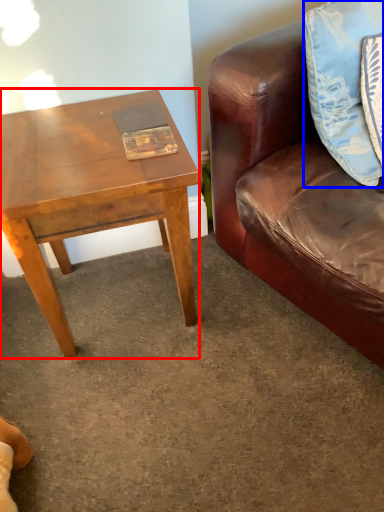
Question: Which object appears farthest to the camera in this image, coffee table (highlighted by a red box) or pillow (highlighted by a blue box)?

Choices:
 (A) coffee table
 (B) pillow

Answer: (A)